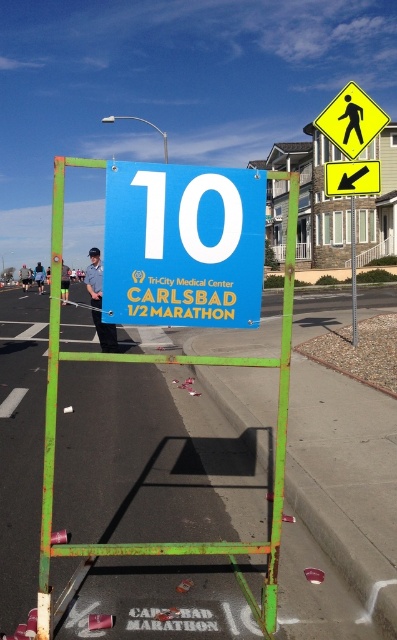
Which is more to the left, yellow plastic pedestrian crossing sign at upper right or green metal pole at center?

Positioned to the left is yellow plastic pedestrian crossing sign at upper right.

Can you confirm if yellow plastic pedestrian crossing sign at upper right is smaller than green metal pole at center?

Indeed, yellow plastic pedestrian crossing sign at upper right has a smaller size compared to green metal pole at center.

Who is more forward, (337, 164) or (352, 323)?

Point (337, 164)

In order to click on yellow plastic pedestrian crossing sign at upper right in this screenshot , I will do `click(352, 179)`.

Is yellow diamond pedestrian sign at upper right bigger than green metal pole at center?

No, yellow diamond pedestrian sign at upper right is not bigger than green metal pole at center.

Who is lower down, yellow diamond pedestrian sign at upper right or green metal pole at center?

green metal pole at center

Image resolution: width=397 pixels, height=640 pixels. What do you see at coordinates (350, 120) in the screenshot?
I see `yellow diamond pedestrian sign at upper right` at bounding box center [350, 120].

Locate an element on the screen. This screenshot has width=397, height=640. yellow diamond pedestrian sign at upper right is located at coordinates (350, 120).

I want to click on yellow diamond pedestrian sign at upper right, so click(350, 120).

Which of these two, yellow diamond pedestrian sign at upper right or yellow plastic pedestrian crossing sign at upper right, stands shorter?

With less height is yellow plastic pedestrian crossing sign at upper right.

You are a GUI agent. You are given a task and a screenshot of the screen. Output one action in this format:
    pyautogui.click(x=<x>, y=<y>)
    Task: Click on the yellow diamond pedestrian sign at upper right
    The image size is (397, 640).
    Given the screenshot: What is the action you would take?
    pyautogui.click(x=350, y=120)

Identify the location of yellow diamond pedestrian sign at upper right. The width and height of the screenshot is (397, 640). (350, 120).